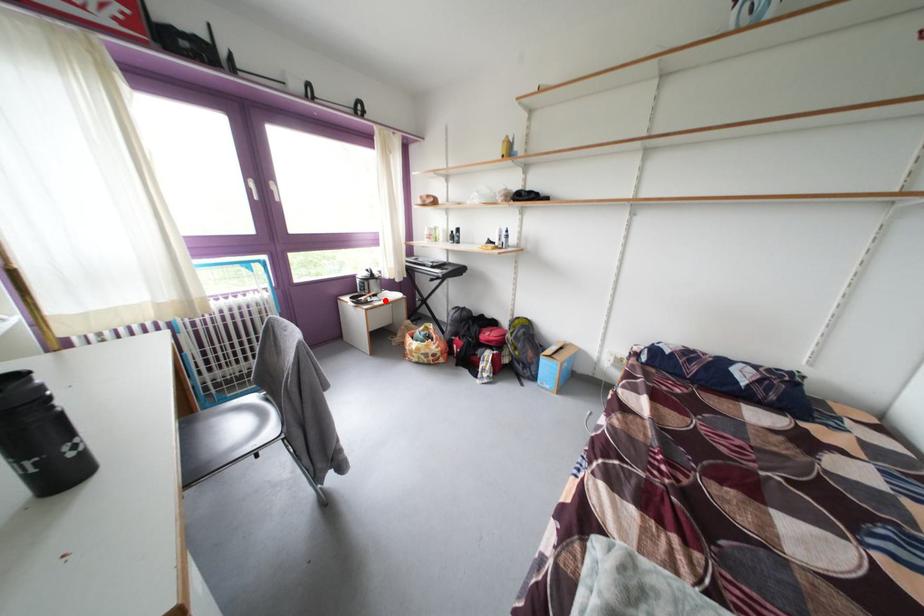
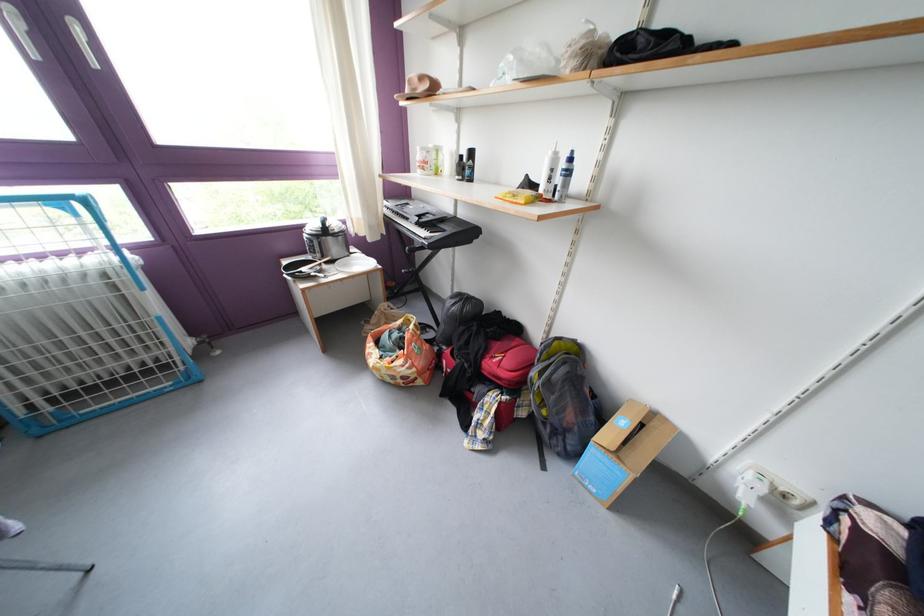
Question: I am providing you with two images of the same scene from different viewpoints. Given a red point in image1, look at the same physical point in image2. Is it:

Choices:
 (A) Closer to the viewpoint
 (B) Farther from the viewpoint

Answer: (A)